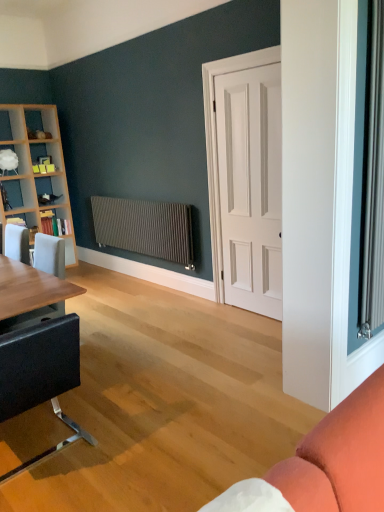
Question: Can you confirm if matte black table at left is wider than wooden bookshelf at left, which is the third shelf in top-to-bottom order?

Choices:
 (A) no
 (B) yes

Answer: (B)

Question: Is matte black table at left to the left of wooden bookshelf at left, which is the third shelf in top-to-bottom order, from the viewer's perspective?

Choices:
 (A) yes
 (B) no

Answer: (B)

Question: Can you confirm if matte black table at left is taller than wooden bookshelf at left, the first shelf in the bottom-to-top sequence?

Choices:
 (A) no
 (B) yes

Answer: (B)

Question: Is matte black table at left at the right side of wooden bookshelf at left, which is the third shelf in top-to-bottom order?

Choices:
 (A) no
 (B) yes

Answer: (B)

Question: From the image's perspective, is matte black table at left beneath wooden bookshelf at left, which is the third shelf in top-to-bottom order?

Choices:
 (A) yes
 (B) no

Answer: (A)

Question: Is matte black table at left bigger than wooden bookshelf at left, the first shelf in the bottom-to-top sequence?

Choices:
 (A) yes
 (B) no

Answer: (A)

Question: Is matte coral fabric couch at lower right facing away from white matte door at center?

Choices:
 (A) no
 (B) yes

Answer: (A)

Question: From the image's perspective, is matte coral fabric couch at lower right on white matte door at center?

Choices:
 (A) yes
 (B) no

Answer: (B)

Question: Is matte coral fabric couch at lower right aimed at white matte door at center?

Choices:
 (A) no
 (B) yes

Answer: (A)

Question: Is matte coral fabric couch at lower right thinner than white matte door at center?

Choices:
 (A) no
 (B) yes

Answer: (A)

Question: Are matte coral fabric couch at lower right and white matte door at center located far from each other?

Choices:
 (A) no
 (B) yes

Answer: (B)

Question: Is matte coral fabric couch at lower right located outside white matte door at center?

Choices:
 (A) yes
 (B) no

Answer: (A)

Question: From a real-world perspective, does white glossy shelf at upper left, which is the third shelf in bottom-to-top order, sit lower than wooden bookshelf at left, arranged as the 2th shelf when viewed from the top?

Choices:
 (A) yes
 (B) no

Answer: (B)